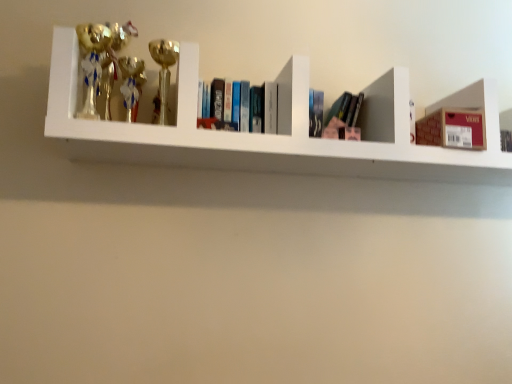
Question: Would you say hardcover books at center is a long distance from gold shiny trophy at upper left, which is the first toy from right to left?

Choices:
 (A) yes
 (B) no

Answer: (B)

Question: Can you confirm if hardcover books at center is positioned to the left of gold shiny trophy at upper left, which is the first toy from right to left?

Choices:
 (A) no
 (B) yes

Answer: (A)

Question: Would you say gold shiny trophy at upper left, which is the first toy from right to left, is part of hardcover books at center's contents?

Choices:
 (A) yes
 (B) no

Answer: (B)

Question: Is hardcover books at center not inside gold shiny trophy at upper left, the second toy viewed from the left?

Choices:
 (A) no
 (B) yes

Answer: (B)

Question: Can you confirm if hardcover books at center is smaller than gold shiny trophy at upper left, the second toy viewed from the left?

Choices:
 (A) yes
 (B) no

Answer: (B)

Question: Considering the relative positions of hardcover books at center and gold shiny trophy at upper left, which is the first toy from right to left, in the image provided, is hardcover books at center to the left or to the right of gold shiny trophy at upper left, which is the first toy from right to left,?

Choices:
 (A) right
 (B) left

Answer: (A)

Question: Considering the positions of hardcover books at center and gold shiny trophy at upper left, the second toy viewed from the left, in the image, is hardcover books at center bigger or smaller than gold shiny trophy at upper left, the second toy viewed from the left,?

Choices:
 (A) big
 (B) small

Answer: (A)

Question: Is hardcover books at center in front of or behind gold shiny trophy at upper left, the second toy viewed from the left, in the image?

Choices:
 (A) behind
 (B) front

Answer: (A)

Question: Choose the correct answer: Is hardcover books at center inside gold shiny trophy at upper left, which is the first toy from right to left, or outside it?

Choices:
 (A) inside
 (B) outside

Answer: (B)

Question: Considering the relative positions of metallic trophies at left and gold shiny trophy at left, which ranks as the 2th toy in right-to-left order, in the image provided, is metallic trophies at left to the left or to the right of gold shiny trophy at left, which ranks as the 2th toy in right-to-left order,?

Choices:
 (A) left
 (B) right

Answer: (B)

Question: From the image's perspective, is metallic trophies at left positioned above or below gold shiny trophy at left, which is the 1th toy in left-to-right order?

Choices:
 (A) above
 (B) below

Answer: (B)

Question: Is point (225, 145) closer or farther from the camera than point (86, 102)?

Choices:
 (A) farther
 (B) closer

Answer: (B)

Question: Is metallic trophies at left inside or outside of gold shiny trophy at left, which ranks as the 2th toy in right-to-left order?

Choices:
 (A) inside
 (B) outside

Answer: (B)

Question: Is gold shiny trophy at left, which ranks as the 2th toy in right-to-left order, bigger or smaller than hardcover books at center?

Choices:
 (A) big
 (B) small

Answer: (B)

Question: From the image's perspective, relative to hardcover books at center, is gold shiny trophy at left, which ranks as the 2th toy in right-to-left order, above or below?

Choices:
 (A) above
 (B) below

Answer: (A)